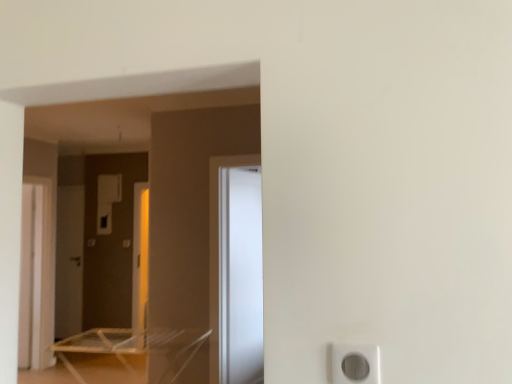
Image resolution: width=512 pixels, height=384 pixels. Describe the element at coordinates (31, 276) in the screenshot. I see `white plastic screen door at left, positioned as the 2th screen door in right-to-left order` at that location.

At what (x,y) coordinates should I click in order to perform the action: click on white plastic screen door at left, placed as the 2th screen door when sorted from left to right. Please return your answer as a coordinate pair (x, y). This screenshot has width=512, height=384. Looking at the image, I should click on (31, 276).

Where is `white glossy screen door at center, placed as the first screen door when sorted from front to back`? The width and height of the screenshot is (512, 384). white glossy screen door at center, placed as the first screen door when sorted from front to back is located at coordinates (240, 276).

The width and height of the screenshot is (512, 384). What do you see at coordinates (355, 363) in the screenshot? I see `white glossy electric outlet at lower right` at bounding box center [355, 363].

Identify the location of matte brown screen door at left, arranged as the 1th screen door when viewed from the back. (69, 261).

Is clear plastic table at lower left at the back of white glossy screen door at center, which is the 3th screen door from back to front?

white glossy screen door at center, which is the 3th screen door from back to front, is not turned away from clear plastic table at lower left.

Does white glossy screen door at center, which is the 1th screen door in right-to-left order, have a lesser width compared to clear plastic table at lower left?

Correct, the width of white glossy screen door at center, which is the 1th screen door in right-to-left order, is less than that of clear plastic table at lower left.

Considering the sizes of objects white glossy screen door at center, which is the 3th screen door from back to front, and clear plastic table at lower left in the image provided, who is bigger, white glossy screen door at center, which is the 3th screen door from back to front, or clear plastic table at lower left?

With larger size is clear plastic table at lower left.

Is white glossy screen door at center, placed as the first screen door when sorted from front to back, spatially inside clear plastic table at lower left, or outside of it?

white glossy screen door at center, placed as the first screen door when sorted from front to back, cannot be found inside clear plastic table at lower left.

From the image's perspective, relative to white glossy screen door at center, marked as the 3th screen door in a left-to-right arrangement, is white glossy electric outlet at lower right above or below?

white glossy electric outlet at lower right is above white glossy screen door at center, marked as the 3th screen door in a left-to-right arrangement.

Where is `electric outlet in front of the white glossy screen door at center, which is the 1th screen door in right-to-left order`? electric outlet in front of the white glossy screen door at center, which is the 1th screen door in right-to-left order is located at coordinates (355, 363).

Which of these two, white glossy electric outlet at lower right or white glossy screen door at center, marked as the 3th screen door in a left-to-right arrangement, is bigger?

white glossy screen door at center, marked as the 3th screen door in a left-to-right arrangement, is bigger.

Between white glossy electric outlet at lower right and clear plastic table at lower left, which one has more height?

clear plastic table at lower left is taller.

From a real-world perspective, does white glossy electric outlet at lower right stand above clear plastic table at lower left?

Yes, from a real-world perspective, white glossy electric outlet at lower right is above clear plastic table at lower left.

Considering the points (379, 367) and (174, 348), which point is in front, point (379, 367) or point (174, 348)?

Positioned in front is point (379, 367).

How different are the orientations of white glossy electric outlet at lower right and clear plastic table at lower left in degrees?

The angle between the facing direction of white glossy electric outlet at lower right and the facing direction of clear plastic table at lower left is 0.0014 degrees.

Based on their positions, is clear plastic table at lower left located to the left or right of white glossy screen door at center, which is the 3th screen door from back to front?

From the image, it's evident that clear plastic table at lower left is to the left of white glossy screen door at center, which is the 3th screen door from back to front.

From the image's perspective, which screen door is the 3rd one above the clear plastic table at lower left? Please provide its 2D coordinates.

[(240, 276)]

Is white plastic screen door at left, placed as the 2th screen door when sorted from front to back, directly adjacent to clear plastic table at lower left?

white plastic screen door at left, placed as the 2th screen door when sorted from front to back, and clear plastic table at lower left are not in contact.

Is white plastic screen door at left, placed as the 2th screen door when sorted from left to right, taller than clear plastic table at lower left?

Correct, white plastic screen door at left, placed as the 2th screen door when sorted from left to right, is much taller as clear plastic table at lower left.

From the picture: Considering the positions of objects white plastic screen door at left, acting as the 2th screen door starting from the back, and clear plastic table at lower left in the image provided, who is more to the right, white plastic screen door at left, acting as the 2th screen door starting from the back, or clear plastic table at lower left?

clear plastic table at lower left is more to the right.

Is point (38, 345) positioned before point (97, 353)?

No, it is behind (97, 353).

Considering the relative sizes of white plastic screen door at left, placed as the 2th screen door when sorted from left to right, and matte brown screen door at left, which ranks as the third screen door in front-to-back order, in the image provided, is white plastic screen door at left, placed as the 2th screen door when sorted from left to right, thinner than matte brown screen door at left, which ranks as the third screen door in front-to-back order,?

No.

Could you measure the distance between white plastic screen door at left, positioned as the 2th screen door in right-to-left order, and matte brown screen door at left, arranged as the 1th screen door when viewed from the back?

white plastic screen door at left, positioned as the 2th screen door in right-to-left order, and matte brown screen door at left, arranged as the 1th screen door when viewed from the back, are 29.89 inches apart.

Which is correct: white plastic screen door at left, placed as the 2th screen door when sorted from left to right, is inside matte brown screen door at left, arranged as the 1th screen door when viewed from the back, or outside of it?

white plastic screen door at left, placed as the 2th screen door when sorted from left to right, lies outside matte brown screen door at left, arranged as the 1th screen door when viewed from the back.

Does point (19, 317) appear closer or farther from the camera than point (58, 258)?

Point (19, 317) appears to be closer to the viewer than point (58, 258).

Is white glossy screen door at center, marked as the 3th screen door in a left-to-right arrangement, in front of or behind white plastic screen door at left, positioned as the 2th screen door in right-to-left order, in the image?

white glossy screen door at center, marked as the 3th screen door in a left-to-right arrangement, is positioned closer to the viewer than white plastic screen door at left, positioned as the 2th screen door in right-to-left order.

From the image's perspective, count 2nd screen doors upward from the white plastic screen door at left, placed as the 2th screen door when sorted from front to back, and point to it. Please provide its 2D coordinates.

[(240, 276)]

Could you tell me if white glossy screen door at center, which is the 3th screen door from back to front, is turned towards white plastic screen door at left, positioned as the 2th screen door in right-to-left order?

No, white glossy screen door at center, which is the 3th screen door from back to front, is not turned towards white plastic screen door at left, positioned as the 2th screen door in right-to-left order.

Consider the image. Considering the positions of objects white glossy screen door at center, which is the 3th screen door from back to front, and white plastic screen door at left, placed as the 2th screen door when sorted from front to back, in the image provided, who is more to the right, white glossy screen door at center, which is the 3th screen door from back to front, or white plastic screen door at left, placed as the 2th screen door when sorted from front to back,?

white glossy screen door at center, which is the 3th screen door from back to front.

Locate an element on the screen. The image size is (512, 384). screen door located on the right of clear plastic table at lower left is located at coordinates pos(240,276).

At what (x,y) coordinates should I click in order to perform the action: click on electric outlet located above the white glossy screen door at center, marked as the 3th screen door in a left-to-right arrangement (from the image's perspective). Please return your answer as a coordinate pair (x, y). The height and width of the screenshot is (384, 512). Looking at the image, I should click on (355, 363).

When comparing their distances from white glossy electric outlet at lower right, does white glossy screen door at center, which is the 3th screen door from back to front, or white plastic screen door at left, placed as the 2th screen door when sorted from front to back, seem closer?

Based on the image, white glossy screen door at center, which is the 3th screen door from back to front, appears to be nearer to white glossy electric outlet at lower right.

From the image, which object appears to be farther from matte brown screen door at left, which ranks as the third screen door in front-to-back order, clear plastic table at lower left or white glossy screen door at center, which is the 1th screen door in right-to-left order?

white glossy screen door at center, which is the 1th screen door in right-to-left order, lies further to matte brown screen door at left, which ranks as the third screen door in front-to-back order, than the other object.

When comparing their distances from white glossy screen door at center, placed as the first screen door when sorted from front to back, does white glossy electric outlet at lower right or clear plastic table at lower left seem further?

white glossy electric outlet at lower right lies further to white glossy screen door at center, placed as the first screen door when sorted from front to back, than the other object.

Estimate the real-world distances between objects in this image. Which object is further from clear plastic table at lower left, white plastic screen door at left, positioned as the 2th screen door in right-to-left order, or matte brown screen door at left, the 3th screen door viewed from the right?

Among the two, matte brown screen door at left, the 3th screen door viewed from the right, is located further to clear plastic table at lower left.

From the image, which object appears to be nearer to white glossy screen door at center, which is the 1th screen door in right-to-left order, matte brown screen door at left, the 3th screen door viewed from the right, or white plastic screen door at left, placed as the 2th screen door when sorted from front to back?

white plastic screen door at left, placed as the 2th screen door when sorted from front to back, is closer to white glossy screen door at center, which is the 1th screen door in right-to-left order.

From the image, which object appears to be farther from white glossy electric outlet at lower right, clear plastic table at lower left or white plastic screen door at left, placed as the 2th screen door when sorted from front to back?

white plastic screen door at left, placed as the 2th screen door when sorted from front to back, lies further to white glossy electric outlet at lower right than the other object.

Which object lies nearer to the anchor point white glossy screen door at center, placed as the first screen door when sorted from front to back, white plastic screen door at left, placed as the 2th screen door when sorted from front to back, or clear plastic table at lower left?

clear plastic table at lower left lies closer to white glossy screen door at center, placed as the first screen door when sorted from front to back, than the other object.

Considering their positions, is white plastic screen door at left, placed as the 2th screen door when sorted from left to right, positioned closer to matte brown screen door at left, acting as the first screen door starting from the left, than white glossy screen door at center, which is the 3th screen door from back to front?

Among the two, white plastic screen door at left, placed as the 2th screen door when sorted from left to right, is located nearer to matte brown screen door at left, acting as the first screen door starting from the left.

You are a GUI agent. You are given a task and a screenshot of the screen. Output one action in this format:
    pyautogui.click(x=<x>, y=<y>)
    Task: Click on the furniture between white glossy electric outlet at lower right and white plastic screen door at left, placed as the 2th screen door when sorted from front to back, along the z-axis
    
    Given the screenshot: What is the action you would take?
    pyautogui.click(x=134, y=346)

You are a GUI agent. You are given a task and a screenshot of the screen. Output one action in this format:
    pyautogui.click(x=<x>, y=<y>)
    Task: Click on the screen door situated between matte brown screen door at left, the 3th screen door viewed from the right, and white glossy screen door at center, which is the 3th screen door from back to front, from left to right
    The height and width of the screenshot is (384, 512).
    Given the screenshot: What is the action you would take?
    pyautogui.click(x=31, y=276)

Find the location of `furniture positioned between white glossy electric outlet at lower right and matte brown screen door at left, which ranks as the third screen door in front-to-back order, from near to far`. furniture positioned between white glossy electric outlet at lower right and matte brown screen door at left, which ranks as the third screen door in front-to-back order, from near to far is located at coordinates (134, 346).

The image size is (512, 384). In order to click on furniture between white glossy electric outlet at lower right and white glossy screen door at center, which is the 1th screen door in right-to-left order, along the z-axis in this screenshot , I will do pyautogui.click(x=134, y=346).